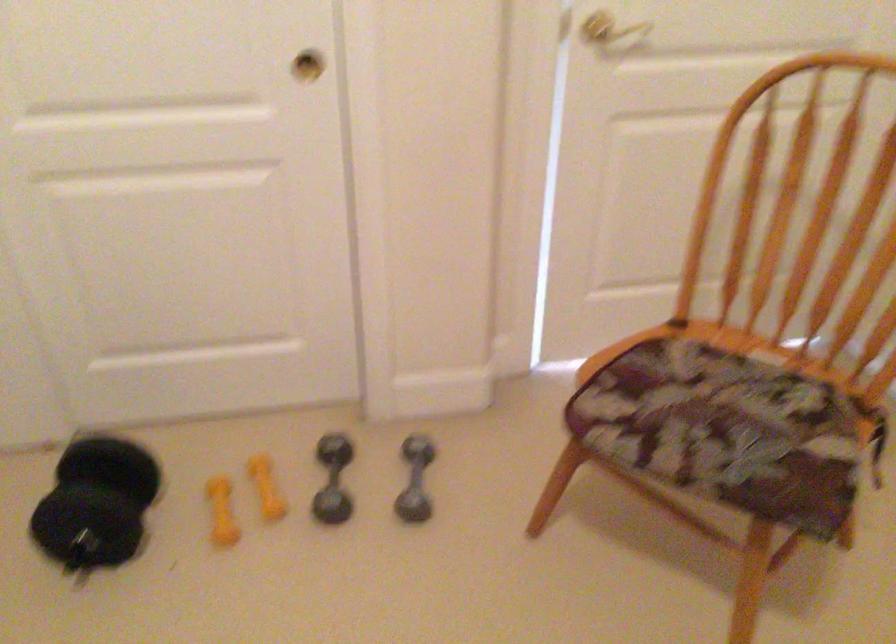
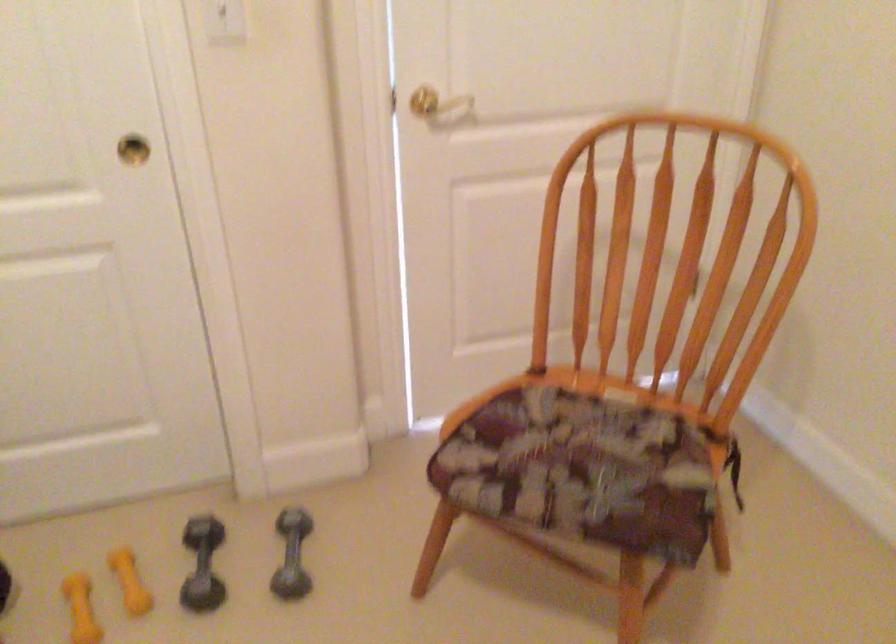
Question: What movement of the cameraman would produce the second image?

Choices:
 (A) Left
 (B) Right
 (C) Forward
 (D) Backward

Answer: (B)